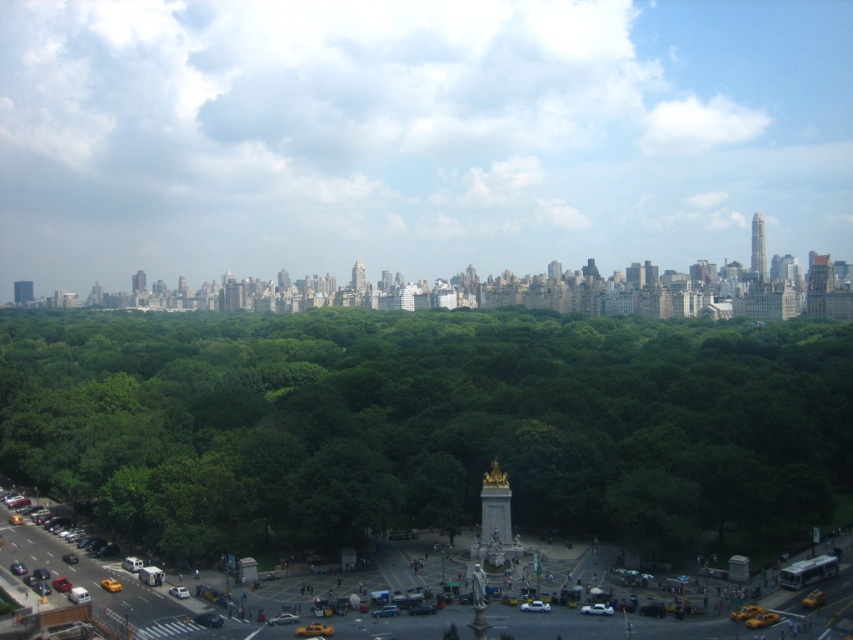
You are standing in the park and want to know how far the point at coordinates (759, 236) is from you. Can you determine the distance?

The point at coordinates (759, 236) is 610.66 meters away from the viewer.

You are standing at the monument in the center of the park and want to reach the busy street with yellow taxis. There are two points marked on the map at coordinates point (753, 272) and point (355, 289). Which point should you head towards to reach the street?

You should head towards point (355, 289) because it is closer to the busy street with yellow taxis located in the lower left corner of the park.

You are a drone operator who needs to fly a drone from the gold metallic spire at center to the gold metallic skyscraper at upper right. Given that your drone has a maximum range of 150 meters, will it be able to reach the skyscraper without needing a recharge?

The distance between the gold metallic skyscraper at upper right and the gold metallic spire at center is 170.27 meters, which exceeds the drone operator maximum range of 150 meters. Therefore, the drone will not be able to reach the skyscraper without needing a recharge.